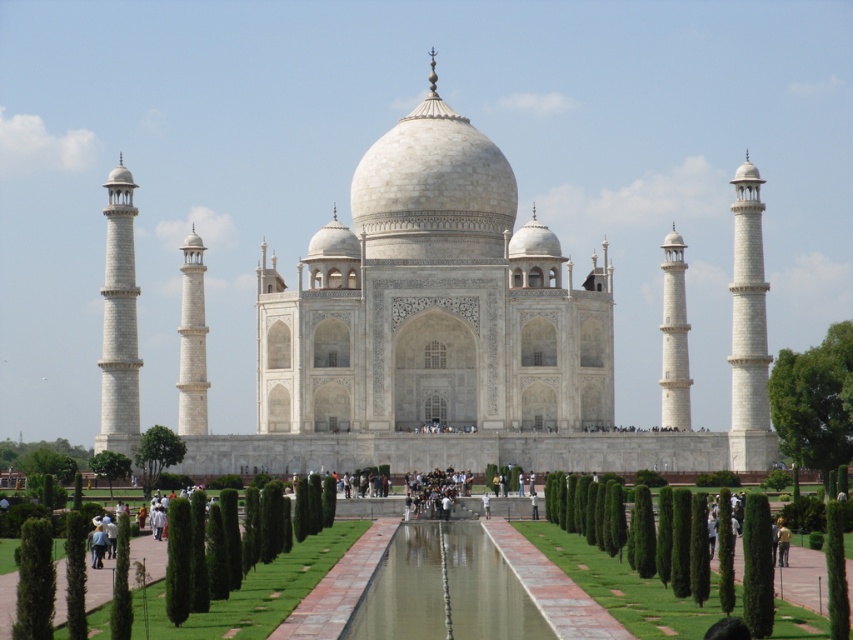
Question: Considering the real-world distances, which object is farthest from the green grass at center?

Choices:
 (A) dark blue jeans at center
 (B) white marble taj mahal at center

Answer: (B)

Question: Does green grass at center have a lesser width compared to dark blue jeans at center?

Choices:
 (A) yes
 (B) no

Answer: (B)

Question: Can you confirm if white marble taj mahal at center is bigger than green grass at center?

Choices:
 (A) no
 (B) yes

Answer: (B)

Question: Which of these objects is positioned closest to the white marble taj mahal at center?

Choices:
 (A) dark blue jeans at center
 (B) green grass at center

Answer: (A)

Question: Which of the following is the closest to the observer?

Choices:
 (A) white marble taj mahal at center
 (B) dark blue jeans at center

Answer: (B)

Question: Does white marble taj mahal at center appear on the right side of dark blue jeans at center?

Choices:
 (A) no
 (B) yes

Answer: (A)